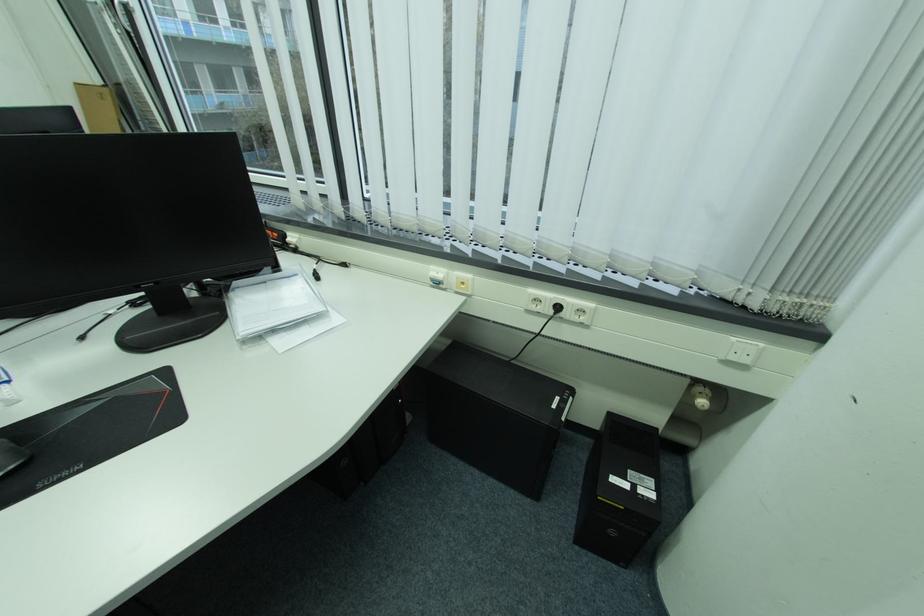
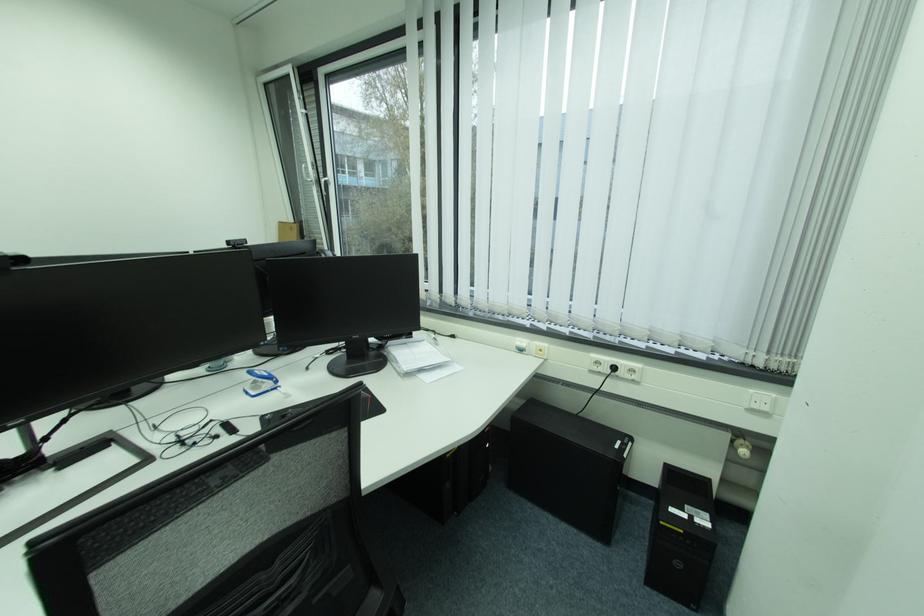
The point at (543, 301) is marked in the first image. Where is the corresponding point in the second image?

(605, 363)